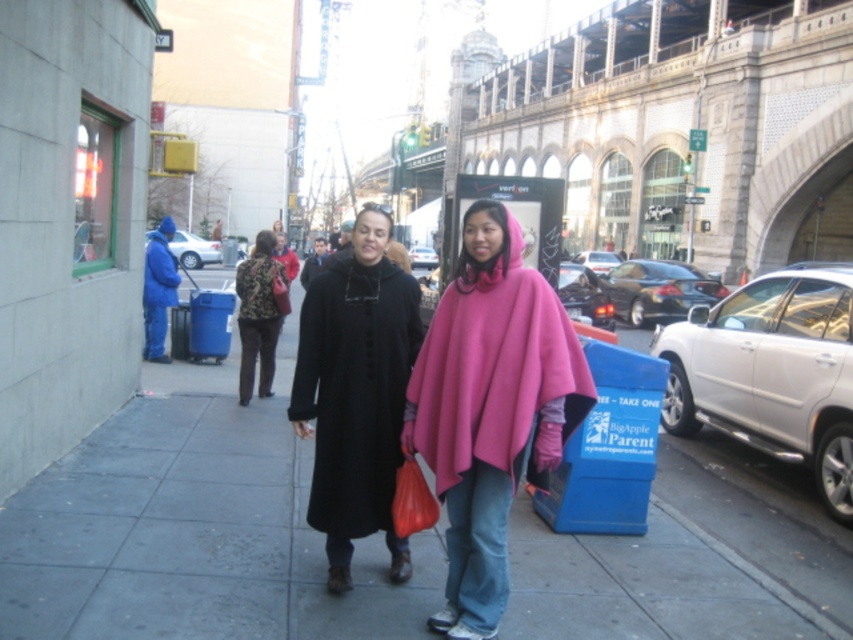
Question: Which point is farther to the camera?

Choices:
 (A) (627, 548)
 (B) (393, 292)
 (C) (259, 234)
 (D) (454, 513)

Answer: (C)

Question: Is smooth concrete sidewalk at center further to the viewer compared to pink fleece poncho at center?

Choices:
 (A) no
 (B) yes

Answer: (A)

Question: Is smooth concrete sidewalk at center wider than black matte coat at center?

Choices:
 (A) yes
 (B) no

Answer: (A)

Question: Is smooth concrete sidewalk at center behind floral fabric coat at center?

Choices:
 (A) yes
 (B) no

Answer: (B)

Question: Which object is the closest to the black matte coat at center?

Choices:
 (A) smooth concrete sidewalk at center
 (B) pink fleece poncho at center
 (C) floral fabric coat at center

Answer: (B)

Question: Which object appears farthest from the camera in this image?

Choices:
 (A) black matte coat at center
 (B) smooth concrete sidewalk at center

Answer: (A)